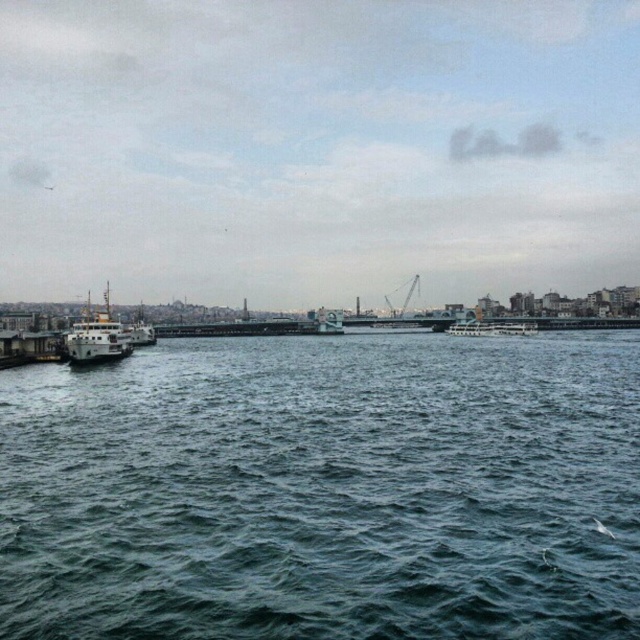
You are a photographer standing on the pier and want to capture both the dark blue water at center and the white matte boat at left in your photo. Which object appears taller in the frame?

The white matte boat at left appears taller than the dark blue water at center in the frame because the white matte boat at left is taller than the dark blue water at center.